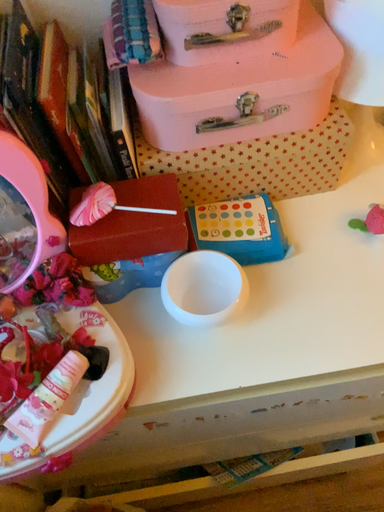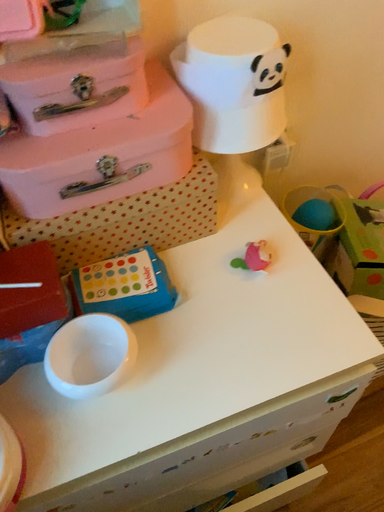
Question: How did the camera likely rotate when shooting the video?

Choices:
 (A) rotated right
 (B) rotated left

Answer: (A)